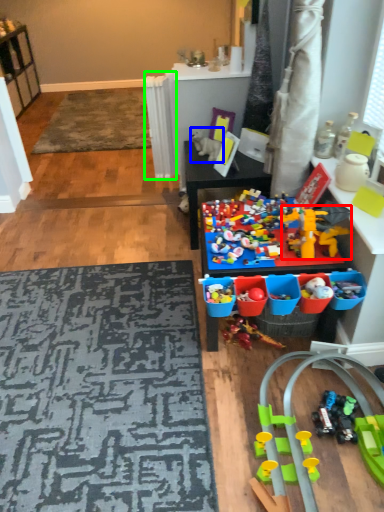
Question: Which is farther away from toy (highlighted by a red box)? toy (highlighted by a blue box) or radiator (highlighted by a green box)?

Choices:
 (A) toy
 (B) radiator

Answer: (B)